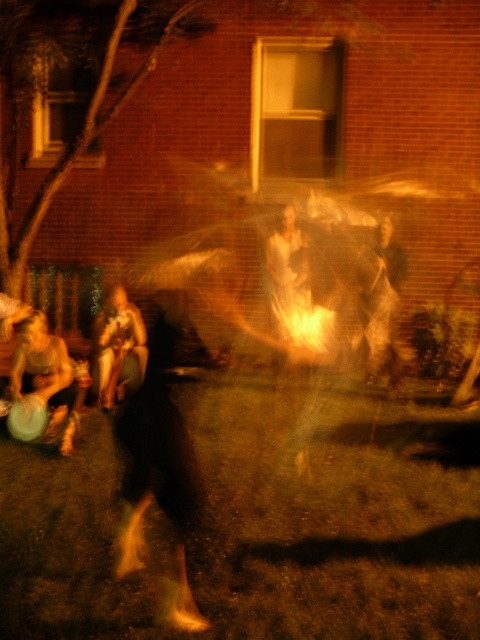
You are standing in the backyard scene described. You see a matte black frisbee at lower left and a smooth beige sweater at lower left. Which object is positioned more to the left side of the scene?

The matte black frisbee at lower left is positioned more to the left side of the scene than the smooth beige sweater at lower left.

You are a delivery person who needs to place a 3.5 meter long package between the dark fabric bag at center and the smooth beige sweater at lower left. Is there enough space to place it without overlapping either object?

The distance between the dark fabric bag at center and the smooth beige sweater at lower left is 3.60 meters. Since the package is 3.5 meters long, there is enough space to place it without overlapping either object.